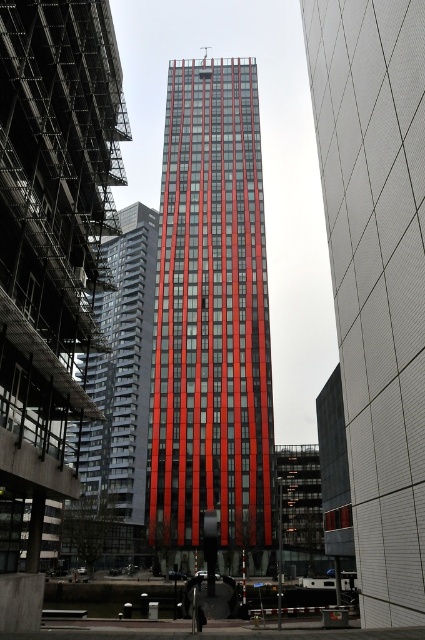
Is red glass skyscraper at center below red glass tower at center?

Yes.

Is the position of red glass skyscraper at center less distant than that of red glass tower at center?

That is True.

You are a GUI agent. You are given a task and a screenshot of the screen. Output one action in this format:
    pyautogui.click(x=<x>, y=<y>)
    Task: Click on the red glass skyscraper at center
    
    Given the screenshot: What is the action you would take?
    [x=50, y=259]

Where is `red glass skyscraper at center`? This screenshot has height=640, width=425. red glass skyscraper at center is located at coordinates (50, 259).

The height and width of the screenshot is (640, 425). I want to click on red glass skyscraper at center, so click(50, 259).

Locate an element on the screen. The image size is (425, 640). red glass skyscraper at center is located at coordinates (50, 259).

Is red glass building at center smaller than red glass tower at center?

Yes, red glass building at center is smaller than red glass tower at center.

Can you confirm if red glass building at center is positioned to the right of red glass tower at center?

Yes, red glass building at center is to the right of red glass tower at center.

In order to click on red glass building at center in this screenshot , I will do `click(376, 276)`.